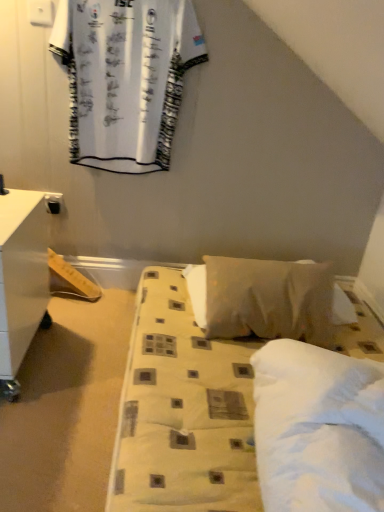
Question: Could you tell me if white printed fabric at upper left is turned towards white soft pillow at center?

Choices:
 (A) yes
 (B) no

Answer: (B)

Question: Considering the relative sizes of white printed fabric at upper left and white soft pillow at center in the image provided, is white printed fabric at upper left bigger than white soft pillow at center?

Choices:
 (A) yes
 (B) no

Answer: (B)

Question: Considering the relative sizes of white printed fabric at upper left and white soft pillow at center in the image provided, is white printed fabric at upper left wider than white soft pillow at center?

Choices:
 (A) no
 (B) yes

Answer: (A)

Question: From a real-world perspective, is white printed fabric at upper left positioned over white soft pillow at center based on gravity?

Choices:
 (A) yes
 (B) no

Answer: (A)

Question: Could white soft pillow at center be considered to be inside white printed fabric at upper left?

Choices:
 (A) no
 (B) yes

Answer: (A)

Question: From the image's perspective, does white printed fabric at upper left appear lower than white soft pillow at center?

Choices:
 (A) no
 (B) yes

Answer: (A)

Question: From the image's perspective, does white glossy nightstand at left appear lower than white fabric bed at center?

Choices:
 (A) yes
 (B) no

Answer: (B)

Question: Is white glossy nightstand at left facing towards white fabric bed at center?

Choices:
 (A) yes
 (B) no

Answer: (B)

Question: Are white glossy nightstand at left and white fabric bed at center beside each other?

Choices:
 (A) no
 (B) yes

Answer: (A)

Question: Can you confirm if white glossy nightstand at left is taller than white fabric bed at center?

Choices:
 (A) no
 (B) yes

Answer: (B)

Question: Would you say white glossy nightstand at left is a long distance from white fabric bed at center?

Choices:
 (A) yes
 (B) no

Answer: (B)

Question: Is white glossy nightstand at left wider than white fabric bed at center?

Choices:
 (A) yes
 (B) no

Answer: (B)

Question: Considering the relative sizes of white fabric bed at center and white soft pillow at center in the image provided, is white fabric bed at center wider than white soft pillow at center?

Choices:
 (A) yes
 (B) no

Answer: (A)